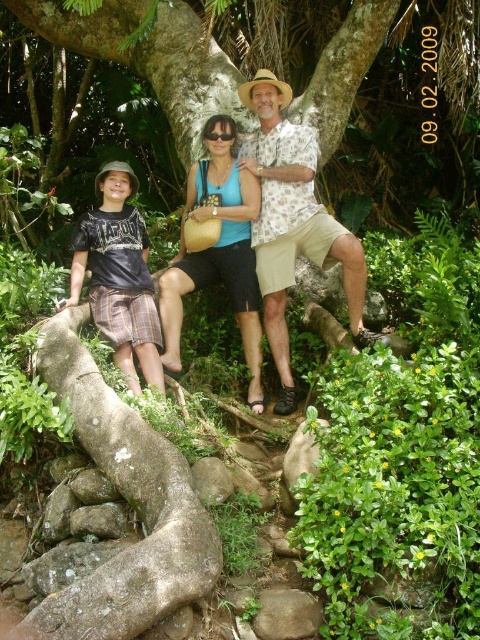
Question: Can you confirm if blue fabric bag at center is bigger than plaid cotton shorts at left?

Choices:
 (A) yes
 (B) no

Answer: (A)

Question: Can you confirm if brown rough tree root at lower left is positioned above plaid cotton shorts at left?

Choices:
 (A) yes
 (B) no

Answer: (B)

Question: Estimate the real-world distances between objects in this image. Which object is farther from the matte black shorts at center?

Choices:
 (A) floral shirt at center
 (B) blue fabric bag at center
 (C) plaid cotton shorts at left

Answer: (C)

Question: Which is farther from the blue fabric bag at center?

Choices:
 (A) plaid cotton shorts at left
 (B) floral shirt at center
 (C) matte black shorts at center
 (D) brown rough tree root at lower left

Answer: (D)

Question: Is brown rough tree root at lower left smaller than matte black shorts at center?

Choices:
 (A) no
 (B) yes

Answer: (A)

Question: Which object is the closest to the blue fabric bag at center?

Choices:
 (A) floral shirt at center
 (B) matte black shorts at center
 (C) brown rough tree root at lower left

Answer: (B)